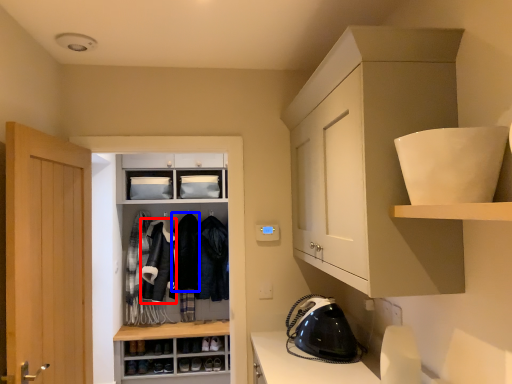
Question: Which of the following is the closest to the observer, clothing (highlighted by a red box) or clothing (highlighted by a blue box)?

Choices:
 (A) clothing
 (B) clothing

Answer: (A)